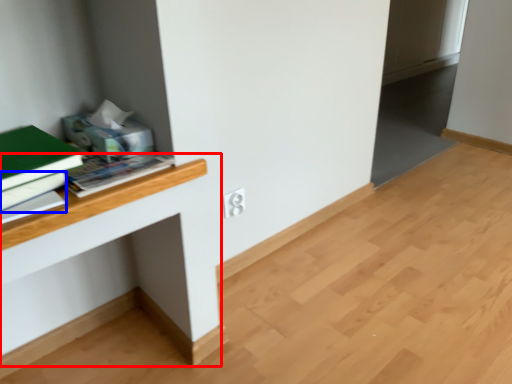
Question: Which object is further to the camera taking this photo, computer desk (highlighted by a red box) or book (highlighted by a blue box)?

Choices:
 (A) computer desk
 (B) book

Answer: (A)